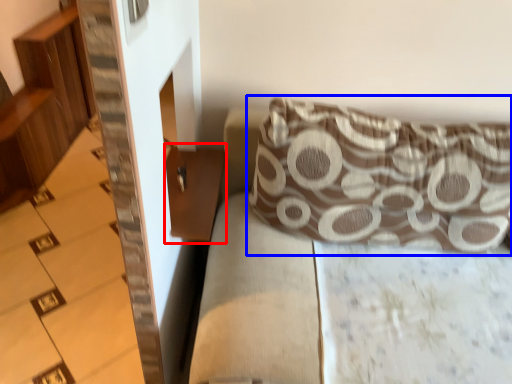
Question: Among these objects, which one is nearest to the camera, table (highlighted by a red box) or pillow (highlighted by a blue box)?

Choices:
 (A) table
 (B) pillow

Answer: (B)